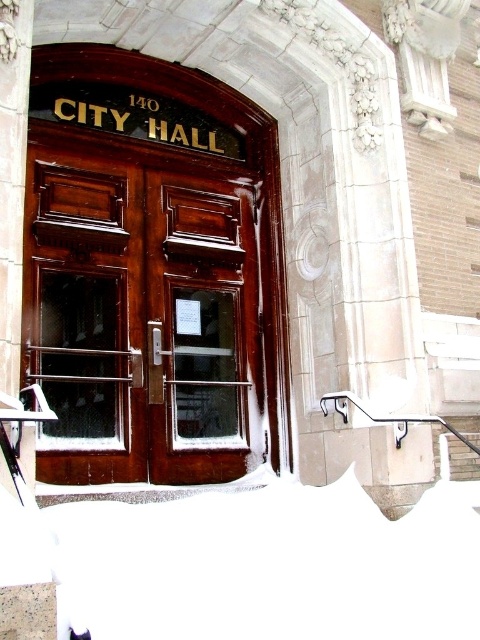
Who is positioned more to the right, shiny dark wood door at center or white fluffy snow at lower center?

Positioned to the right is white fluffy snow at lower center.

Which of these two, shiny dark wood door at center or white fluffy snow at lower center, stands shorter?

white fluffy snow at lower center

Between point (223, 108) and point (379, 605), which one is positioned behind?

Point (223, 108)

Find the location of `shiny dark wood door at center`. shiny dark wood door at center is located at coordinates (152, 273).